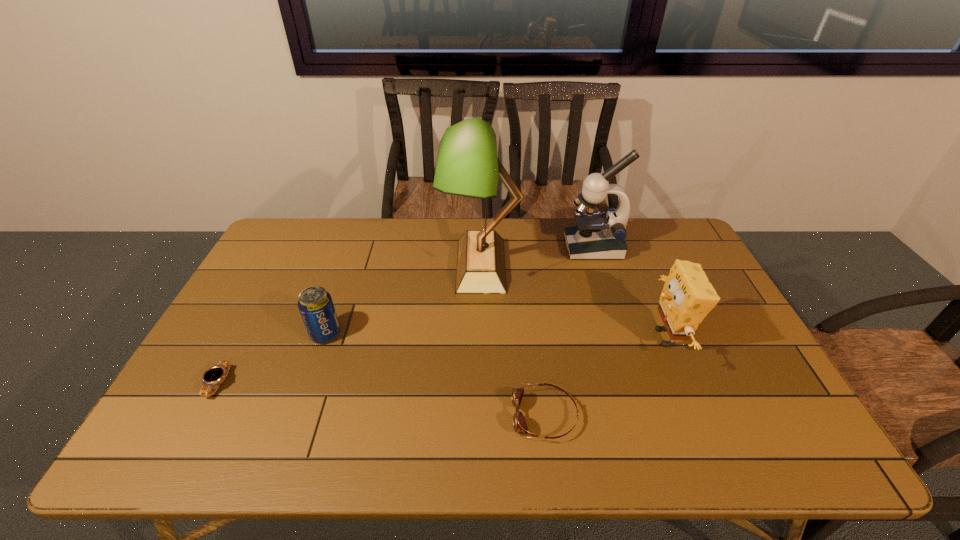
Identify the location of table lamp. The height and width of the screenshot is (540, 960). (467, 165).

Find the location of a particular element. the fifth shortest object is located at coordinates (597, 236).

You are a GUI agent. You are given a task and a screenshot of the screen. Output one action in this format:
    pyautogui.click(x=<x>, y=<y>)
    Task: Click on the fourth shortest object
    This screenshot has width=960, height=540.
    Given the screenshot: What is the action you would take?
    pyautogui.click(x=687, y=297)

This screenshot has height=540, width=960. Find the location of `soda`. soda is located at coordinates (315, 304).

What are the coordinates of `the second object from left to right` in the screenshot? It's located at pos(315,304).

This screenshot has height=540, width=960. In order to click on the second shortest object in this screenshot , I will do [x=519, y=422].

The height and width of the screenshot is (540, 960). What are the coordinates of `the leftmost object` in the screenshot? It's located at (215, 375).

The image size is (960, 540). I want to click on the shortest object, so click(215, 375).

The image size is (960, 540). In order to click on vacant space located on the metallic stand of the table lamp in this screenshot , I will do `click(361, 265)`.

The width and height of the screenshot is (960, 540). I want to click on free location located on the metallic stand of the table lamp, so click(x=395, y=265).